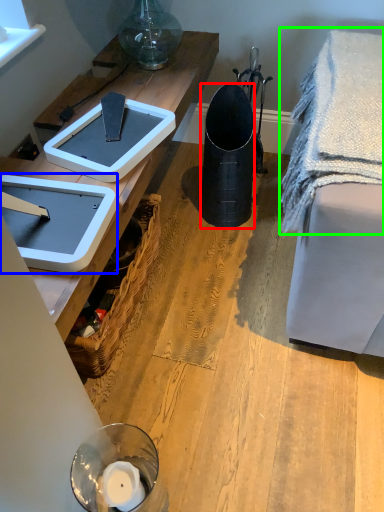
Question: Estimate the real-world distances between objects in this image. Which object is closer to trash bin/can (highlighted by a red box), weight scale (highlighted by a blue box) or blanket (highlighted by a green box)?

Choices:
 (A) weight scale
 (B) blanket

Answer: (B)